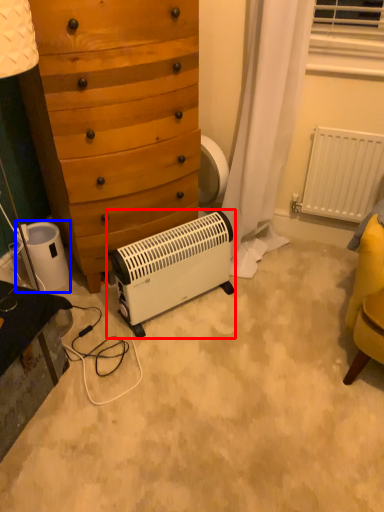
Question: Which object is further to the camera taking this photo, home appliance (highlighted by a red box) or appliance (highlighted by a blue box)?

Choices:
 (A) home appliance
 (B) appliance

Answer: (B)